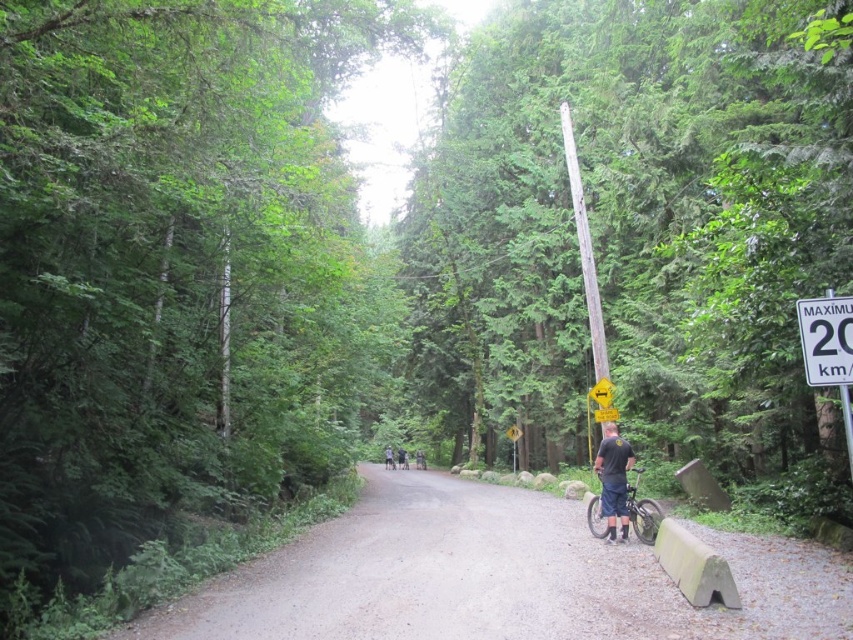
Is smooth wooden pole at right shorter than dark blue shorts at center?

In fact, smooth wooden pole at right may be taller than dark blue shorts at center.

Who is more distant from viewer, (596, 67) or (386, 451)?

The point (386, 451) is more distant.

Image resolution: width=853 pixels, height=640 pixels. Describe the element at coordinates (639, 234) in the screenshot. I see `smooth wooden pole at right` at that location.

Identify the location of smooth wooden pole at right. (639, 234).

Consider the image. Between gray weathered wood pole at center and shiny metallic bicycle at lower right, which one is positioned lower?

shiny metallic bicycle at lower right is lower down.

The width and height of the screenshot is (853, 640). Describe the element at coordinates (584, 248) in the screenshot. I see `gray weathered wood pole at center` at that location.

Is point (596, 328) behind point (601, 499)?

Yes, point (596, 328) is behind point (601, 499).

The width and height of the screenshot is (853, 640). What are the coordinates of `gray weathered wood pole at center` in the screenshot? It's located at (584, 248).

Between white plastic speed limit sign at upper right and dark blue jeans at center, which one has less height?

white plastic speed limit sign at upper right is shorter.

Based on the photo, which of these two, white plastic speed limit sign at upper right or dark blue jeans at center, stands taller?

With more height is dark blue jeans at center.

Is point (811, 333) farther from camera compared to point (407, 458)?

No, it is not.

Identify the location of white plastic speed limit sign at upper right. (827, 339).